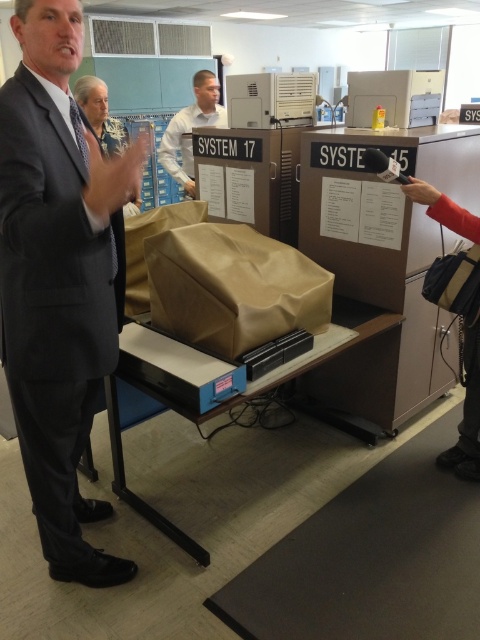
You are a security guard assigned to monitor the office. You notice two people in the scene, the matte black suit at left and the white shirt at center. Which individual is standing closer to the front of the room?

The white shirt at center is standing closer to the front of the room because the matte black suit at left is much taller, meaning the latter is further back.

You are an office assistant who needs to deliver a document to the person in the matte black suit at left. The document must be placed on the brown paper bag at center. Can you reach the person by moving from the document to the bag?

The matte black suit at left is to the left of the brown paper bag at center, so yes, you can reach the person by moving from the document to the bag since the path is straightforward.

Based on the scene description, can you determine the spatial relationship between the brown paper bag at center and the white shirt at center?

The brown paper bag at center is located below the white shirt at center.